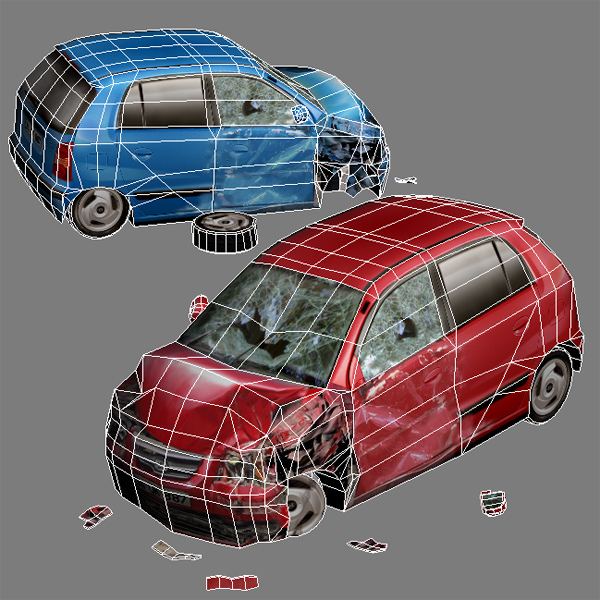
Locate an element on the screen. The width and height of the screenshot is (600, 600). window is located at coordinates pyautogui.click(x=382, y=340).